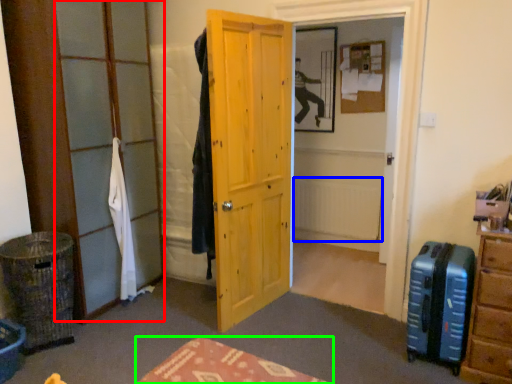
Question: Which object is the farthest from glass door (highlighted by a red box)? Choose among these: radiator (highlighted by a blue box) or furniture (highlighted by a green box).

Choices:
 (A) radiator
 (B) furniture

Answer: (A)